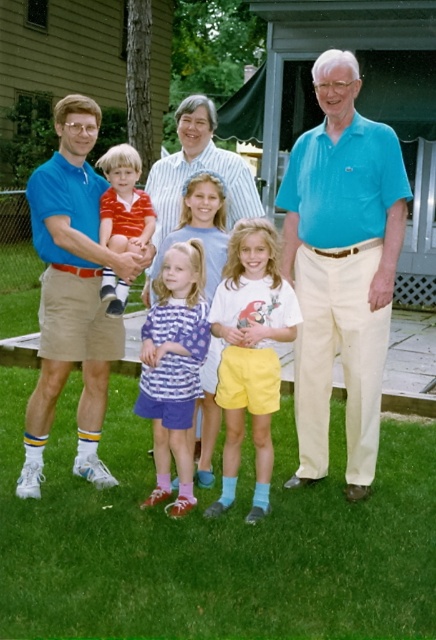
You are a photographer taking a picture of the family gathering. You need to focus on the matte blue shirt at center and the blue cotton polo shirt at left. Which one should you adjust your camera focus for first if you want to ensure both are in focus?

The matte blue shirt at center is closer to the viewer than the blue cotton polo shirt at left. To ensure both are in focus, you should focus on the matte blue shirt at center first as it is closer, and the depth of field will naturally include the farther blue cotton polo shirt at left.

You are a photographer standing at the center of the scene. You need to take a group photo of the teal polo shirt at right and blue cotton polo shirt at left. Given that your camera has a maximum focus range of 1.5 meters between subjects, will both subjects be in focus?

The teal polo shirt at right and blue cotton polo shirt at left are 1.53 meters apart from each other. Since the distance between them exceeds the camera focus range of 1.5 meters, they will not both be in focus.

You are a photographer trying to capture a candid shot of the family. You notice the yellow cotton shorts at center and the striped cotton shirt at left. Which item is positioned closer to the camera?

The yellow cotton shorts at center is closer to the viewer than the striped cotton shirt at left, so the yellow cotton shorts at center would be in focus if the camera is focused on that distance.